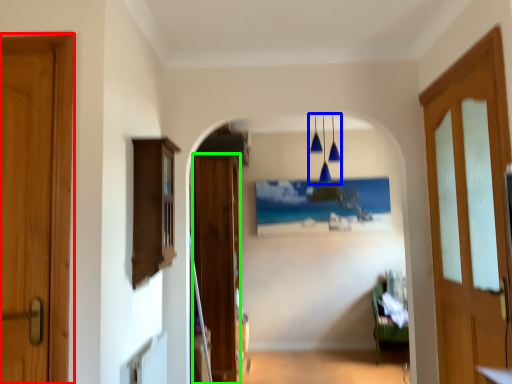
Question: Estimate the real-world distances between objects in this image. Which object is farther from door (highlighted by a red box), light fixture (highlighted by a blue box) or door (highlighted by a green box)?

Choices:
 (A) light fixture
 (B) door

Answer: (A)